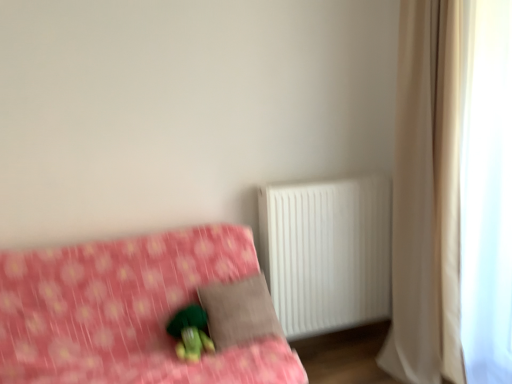
The width and height of the screenshot is (512, 384). What do you see at coordinates (426, 197) in the screenshot?
I see `beige fabric curtain at right` at bounding box center [426, 197].

Describe the element at coordinates (239, 311) in the screenshot. I see `brown fabric pillow at center` at that location.

What do you see at coordinates (126, 311) in the screenshot?
I see `pink fabric bed at lower left` at bounding box center [126, 311].

Identify the location of white sheer curtain at right. Image resolution: width=512 pixels, height=384 pixels. (486, 192).

Based on the photo, who is bigger, beige fabric curtain at right or white plastic radiator at right?

With larger size is beige fabric curtain at right.

Is beige fabric curtain at right oriented away from white plastic radiator at right?

No, beige fabric curtain at right's orientation is not away from white plastic radiator at right.

Is beige fabric curtain at right to the right of white plastic radiator at right from the viewer's perspective?

Yes, beige fabric curtain at right is to the right of white plastic radiator at right.

Is green plush toy at lower center surrounded by beige fabric curtain at right?

No, green plush toy at lower center is not a part of beige fabric curtain at right.

The image size is (512, 384). Find the location of `curtain that is behind the green plush toy at lower center`. curtain that is behind the green plush toy at lower center is located at coordinates [x=426, y=197].

Looking at this image, from a real-world perspective, who is located higher, beige fabric curtain at right or green plush toy at lower center?

beige fabric curtain at right is physically above.

Between beige fabric curtain at right and green plush toy at lower center, which one appears on the right side from the viewer's perspective?

Positioned to the right is beige fabric curtain at right.

How different are the orientations of green plush toy at lower center and beige fabric curtain at right in degrees?

The facing directions of green plush toy at lower center and beige fabric curtain at right are 94.3 degrees apart.

Is green plush toy at lower center facing towards beige fabric curtain at right?

No, green plush toy at lower center is not aimed at beige fabric curtain at right.

Considering the sizes of objects green plush toy at lower center and beige fabric curtain at right in the image provided, who is bigger, green plush toy at lower center or beige fabric curtain at right?

With larger size is beige fabric curtain at right.

Based on the photo, can you see green plush toy at lower center touching beige fabric curtain at right?

They are not placed beside each other.

Who is taller, beige fabric curtain at right or pink fabric bed at lower left?

Standing taller between the two is beige fabric curtain at right.

From a real-world perspective, is beige fabric curtain at right above or below pink fabric bed at lower left?

beige fabric curtain at right is situated higher than pink fabric bed at lower left in the real world.

From the image's perspective, is beige fabric curtain at right below pink fabric bed at lower left?

A: No.

How much distance is there between white plastic radiator at right and pink fabric bed at lower left?

A distance of 26.50 inches exists between white plastic radiator at right and pink fabric bed at lower left.

Is white plastic radiator at right inside the boundaries of pink fabric bed at lower left, or outside?

white plastic radiator at right is outside pink fabric bed at lower left.

From the image's perspective, which one is positioned lower, white plastic radiator at right or pink fabric bed at lower left?

pink fabric bed at lower left is shown below in the image.

From a real-world perspective, which is physically above, white plastic radiator at right or pink fabric bed at lower left?

white plastic radiator at right, from a real-world perspective.

Is white sheer curtain at right located within green plush toy at lower center?

No, green plush toy at lower center does not contain white sheer curtain at right.

Is green plush toy at lower center taller or shorter than white sheer curtain at right?

green plush toy at lower center is shorter than white sheer curtain at right.

Considering the positions of objects green plush toy at lower center and white sheer curtain at right in the image provided, who is more to the right, green plush toy at lower center or white sheer curtain at right?

white sheer curtain at right is more to the right.

From the image's perspective, who appears lower, green plush toy at lower center or white sheer curtain at right?

green plush toy at lower center is shown below in the image.

Are white plastic radiator at right and brown fabric pillow at center making contact?

white plastic radiator at right and brown fabric pillow at center are not in contact.

Would you say white plastic radiator at right is to the left or to the right of brown fabric pillow at center in the picture?

Based on their positions, white plastic radiator at right is located to the right of brown fabric pillow at center.

Is white plastic radiator at right looking in the opposite direction of brown fabric pillow at center?

white plastic radiator at right does not have its back to brown fabric pillow at center.

Identify the location of radiator on the left of the beige fabric curtain at right. This screenshot has width=512, height=384. (327, 253).

Where is `curtain that appears above the green plush toy at lower center (from a real-world perspective)`? curtain that appears above the green plush toy at lower center (from a real-world perspective) is located at coordinates (426, 197).

When comparing their distances from green plush toy at lower center, does brown fabric pillow at center or beige fabric curtain at right seem closer?

Among the two, brown fabric pillow at center is located nearer to green plush toy at lower center.

Looking at the image, which one is located further to beige fabric curtain at right, white plastic radiator at right or green plush toy at lower center?

green plush toy at lower center is positioned further to the anchor beige fabric curtain at right.

Looking at the image, which one is located further to pink fabric bed at lower left, white plastic radiator at right or beige fabric curtain at right?

Among the two, beige fabric curtain at right is located further to pink fabric bed at lower left.

Considering their positions, is white sheer curtain at right positioned closer to green plush toy at lower center than pink fabric bed at lower left?

pink fabric bed at lower left is positioned closer to the anchor green plush toy at lower center.

Based on the photo, based on their spatial positions, is white plastic radiator at right or white sheer curtain at right further from green plush toy at lower center?

The object further to green plush toy at lower center is white sheer curtain at right.

Considering their positions, is beige fabric curtain at right positioned further to white sheer curtain at right than pink fabric bed at lower left?

Based on the image, pink fabric bed at lower left appears to be further to white sheer curtain at right.

Considering their positions, is brown fabric pillow at center positioned closer to green plush toy at lower center than pink fabric bed at lower left?

brown fabric pillow at center is positioned closer to the anchor green plush toy at lower center.

Estimate the real-world distances between objects in this image. Which object is closer to green plush toy at lower center, pink fabric bed at lower left or beige fabric curtain at right?

Based on the image, pink fabric bed at lower left appears to be nearer to green plush toy at lower center.

Where is `curtain between pink fabric bed at lower left and white sheer curtain at right from left to right`? This screenshot has height=384, width=512. curtain between pink fabric bed at lower left and white sheer curtain at right from left to right is located at coordinates (426, 197).

Find the location of `radiator situated between pink fabric bed at lower left and white sheer curtain at right from left to right`. radiator situated between pink fabric bed at lower left and white sheer curtain at right from left to right is located at coordinates (327, 253).

You are a GUI agent. You are given a task and a screenshot of the screen. Output one action in this format:
    pyautogui.click(x=<x>, y=<y>)
    Task: Click on the radiator between pink fabric bed at lower left and beige fabric curtain at right in the horizontal direction
    The image size is (512, 384).
    Given the screenshot: What is the action you would take?
    pyautogui.click(x=327, y=253)

Locate an element on the screen. figurine between pink fabric bed at lower left and white sheer curtain at right from left to right is located at coordinates (190, 333).